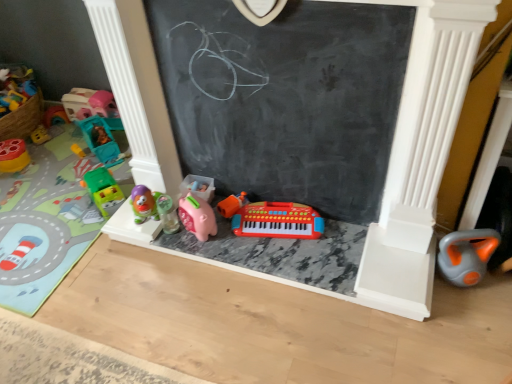
Where is `free location in front of translucent plastic toy car at left, positioned as the fifth toy in right-to-left order`? The height and width of the screenshot is (384, 512). free location in front of translucent plastic toy car at left, positioned as the fifth toy in right-to-left order is located at coordinates (70, 178).